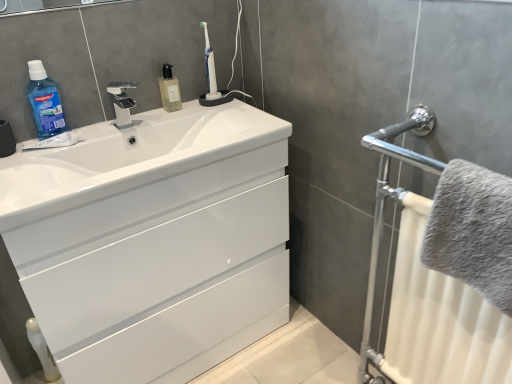
Question: From the image's perspective, does white glossy cabinet at center appear higher than blue translucent liquid at upper left?

Choices:
 (A) yes
 (B) no

Answer: (B)

Question: Can you confirm if white glossy cabinet at center is wider than blue translucent liquid at upper left?

Choices:
 (A) no
 (B) yes

Answer: (B)

Question: Is white glossy cabinet at center directly adjacent to blue translucent liquid at upper left?

Choices:
 (A) yes
 (B) no

Answer: (B)

Question: Considering the relative sizes of white glossy cabinet at center and blue translucent liquid at upper left in the image provided, is white glossy cabinet at center smaller than blue translucent liquid at upper left?

Choices:
 (A) no
 (B) yes

Answer: (A)

Question: Could you tell me if white glossy cabinet at center is facing blue translucent liquid at upper left?

Choices:
 (A) no
 (B) yes

Answer: (A)

Question: Considering the relative sizes of white glossy cabinet at center and blue translucent liquid at upper left in the image provided, is white glossy cabinet at center bigger than blue translucent liquid at upper left?

Choices:
 (A) no
 (B) yes

Answer: (B)

Question: Is blue translucent liquid at upper left closer to the viewer compared to white glossy sink at center?

Choices:
 (A) no
 (B) yes

Answer: (A)

Question: Can you confirm if blue translucent liquid at upper left is wider than white glossy sink at center?

Choices:
 (A) yes
 (B) no

Answer: (B)

Question: From the image's perspective, does blue translucent liquid at upper left appear higher than white glossy sink at center?

Choices:
 (A) no
 (B) yes

Answer: (B)

Question: Would you say blue translucent liquid at upper left contains white glossy sink at center?

Choices:
 (A) no
 (B) yes

Answer: (A)

Question: Does blue translucent liquid at upper left have a lesser height compared to white glossy sink at center?

Choices:
 (A) yes
 (B) no

Answer: (B)

Question: Is blue translucent liquid at upper left completely or partially outside of white glossy sink at center?

Choices:
 (A) no
 (B) yes

Answer: (B)

Question: Is gray fluffy towel at right oriented away from blue translucent liquid at upper left?

Choices:
 (A) no
 (B) yes

Answer: (A)